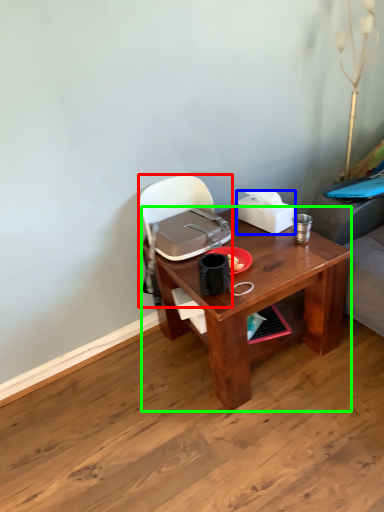
Question: Considering the real-world distances, which object is farthest from handbag (highlighted by a red box)? box (highlighted by a blue box) or desk (highlighted by a green box)?

Choices:
 (A) box
 (B) desk

Answer: (B)